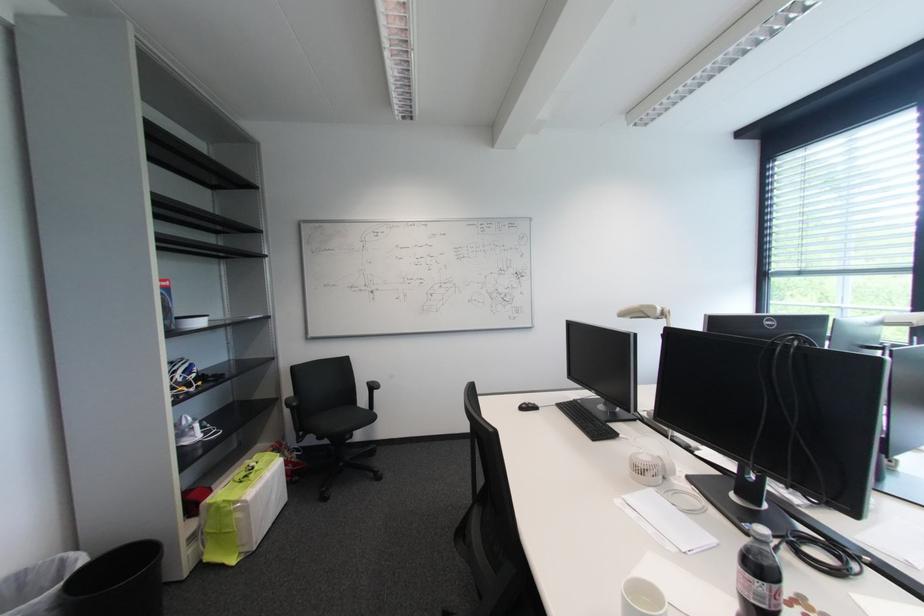
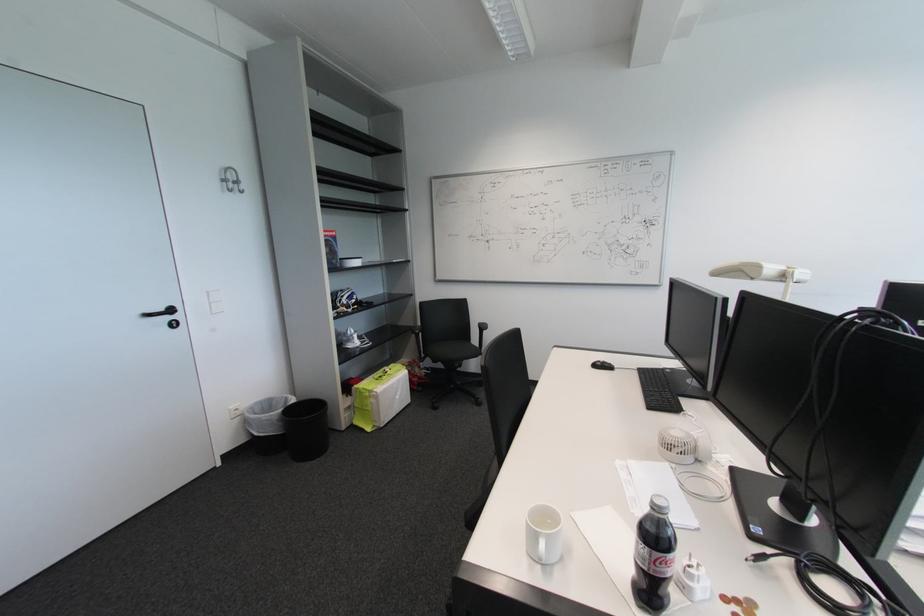
Question: The camera is either moving clockwise (left) or counter-clockwise (right) around the object. The first image is from the beginning of the video and the second image is from the end. Is the camera moving left or right when shooting the video?

Choices:
 (A) Left
 (B) Right

Answer: (B)